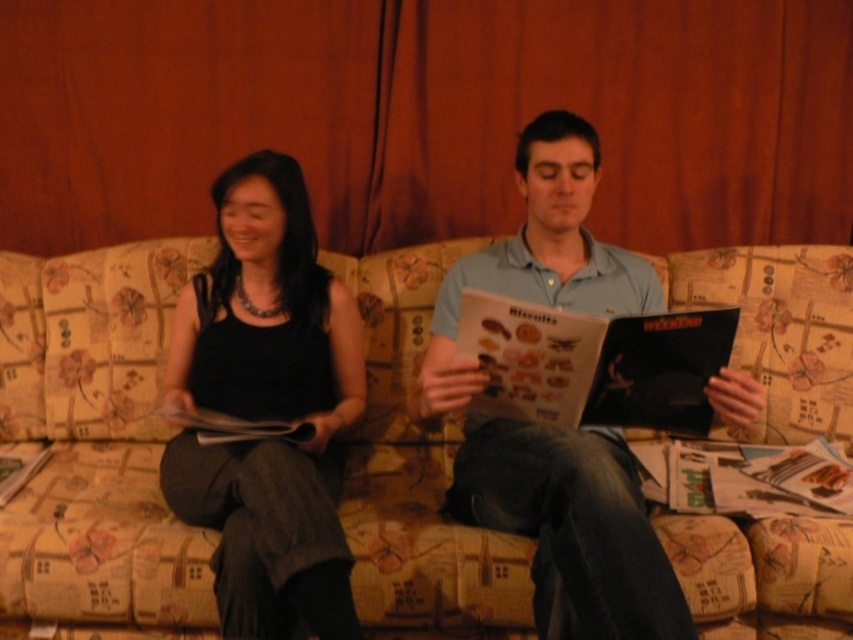
Question: Is black fabric dress at center closer to the viewer compared to light blue cotton shirt at center?

Choices:
 (A) no
 (B) yes

Answer: (A)

Question: Among these objects, which one is farthest from the camera?

Choices:
 (A) black fabric dress at center
 (B) light blue cotton shirt at center

Answer: (A)

Question: Estimate the real-world distances between objects in this image. Which object is closer to the light blue cotton shirt at center?

Choices:
 (A) black fabric dress at center
 (B) floral fabric couch at center

Answer: (A)

Question: Can you confirm if black fabric dress at center is positioned to the left of light blue cotton shirt at center?

Choices:
 (A) yes
 (B) no

Answer: (A)

Question: Does floral fabric couch at center have a smaller size compared to black fabric dress at center?

Choices:
 (A) no
 (B) yes

Answer: (A)

Question: Among these points, which one is nearest to the camera?

Choices:
 (A) (448, 374)
 (B) (334, 497)
 (C) (669, 288)

Answer: (A)